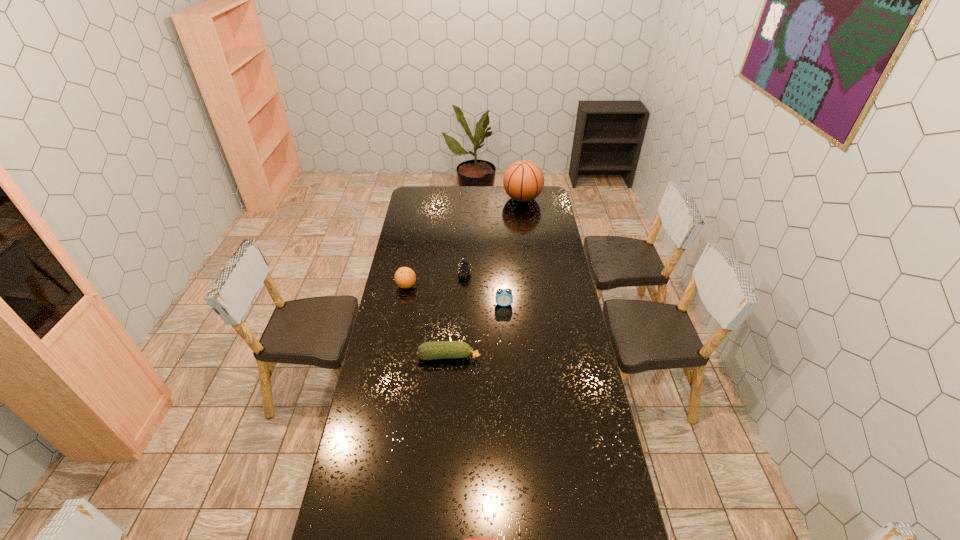
This screenshot has width=960, height=540. In order to click on free location at the far left corner of the desktop in this screenshot , I will do `click(418, 188)`.

At what (x,y) coordinates should I click in order to perform the action: click on vacant space at the far right corner of the desktop. Please return your answer as a coordinate pair (x, y). Image resolution: width=960 pixels, height=540 pixels. Looking at the image, I should click on [x=539, y=197].

Locate an element on the screen. empty location between the fifth farthest object and the third farthest object is located at coordinates (428, 321).

This screenshot has height=540, width=960. What are the coordinates of `unoccupied area between the cucumber and the farther alarm clock` in the screenshot? It's located at (476, 330).

Where is `free spot between the orange and the second farthest object`? free spot between the orange and the second farthest object is located at coordinates (436, 279).

Where is `free space between the orange and the cucumber`? The image size is (960, 540). free space between the orange and the cucumber is located at coordinates (428, 321).

This screenshot has width=960, height=540. I want to click on free space between the third farthest object and the farthest object, so click(465, 242).

Find the location of `empty location between the farther alarm clock and the second farthest object`. empty location between the farther alarm clock and the second farthest object is located at coordinates (484, 288).

Locate an element on the screen. free space between the cucumber and the taller alarm clock is located at coordinates (476, 330).

This screenshot has height=540, width=960. What are the coordinates of `vacant point located between the tallest object and the pinecone` in the screenshot? It's located at (493, 236).